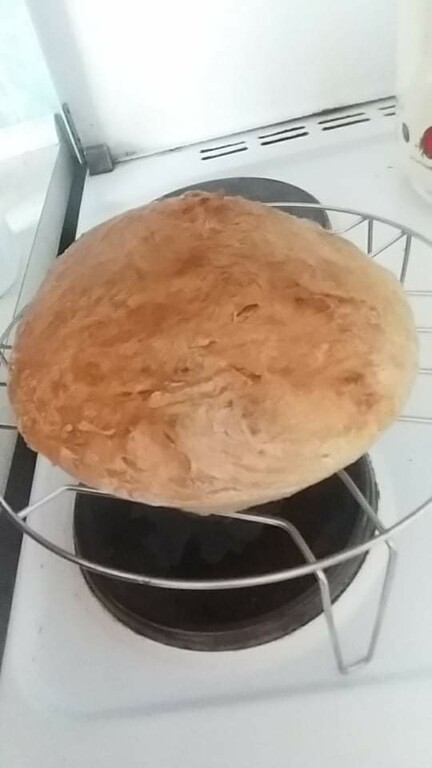
Where is `stove top`? This screenshot has height=768, width=432. stove top is located at coordinates (205, 730), (371, 187).